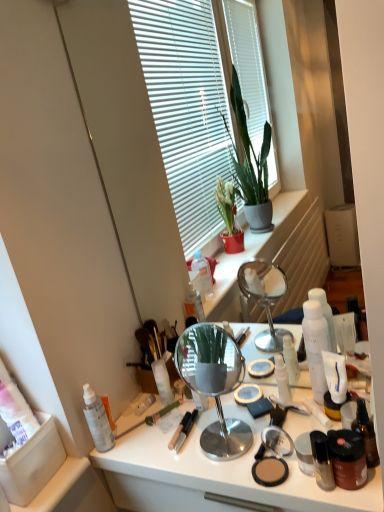
Find the location of a particular element. This screenshot has height=512, width=384. empty space that is ontop of metallic silver mirror at center (from a real-world perspective) is located at coordinates (232, 434).